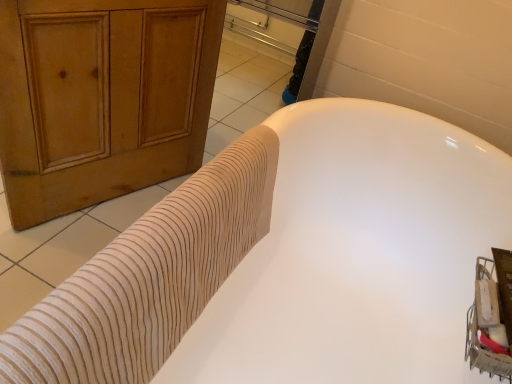
This screenshot has width=512, height=384. Describe the element at coordinates (358, 254) in the screenshot. I see `white ribbed tub at center` at that location.

In order to click on white ribbed tub at center in this screenshot , I will do `click(358, 254)`.

The image size is (512, 384). What do you see at coordinates (149, 277) in the screenshot?
I see `beige textured towel at upper left` at bounding box center [149, 277].

The width and height of the screenshot is (512, 384). In order to click on beige textured towel at upper left in this screenshot , I will do `click(149, 277)`.

Locate an element on the screen. This screenshot has width=512, height=384. white ribbed tub at center is located at coordinates pos(358,254).

Does white ribbed tub at center appear on the right side of beige textured towel at upper left?

Indeed, white ribbed tub at center is positioned on the right side of beige textured towel at upper left.

Considering the relative positions of white ribbed tub at center and beige textured towel at upper left in the image provided, is white ribbed tub at center behind beige textured towel at upper left?

No, the depth of white ribbed tub at center is less than that of beige textured towel at upper left.

Is point (464, 284) closer to camera compared to point (201, 302)?

That is False.

From the image's perspective, is white ribbed tub at center above or below beige textured towel at upper left?

white ribbed tub at center is below beige textured towel at upper left.

From a real-world perspective, is white ribbed tub at center on beige textured towel at upper left?

No, from a real-world perspective, white ribbed tub at center is not over beige textured towel at upper left

Is white ribbed tub at center wider or thinner than beige textured towel at upper left?

Clearly, white ribbed tub at center has more width compared to beige textured towel at upper left.

In terms of height, does white ribbed tub at center look taller or shorter compared to beige textured towel at upper left?

Considering their sizes, white ribbed tub at center has more height than beige textured towel at upper left.

Can you confirm if white ribbed tub at center is bigger than beige textured towel at upper left?

Yes, white ribbed tub at center is bigger than beige textured towel at upper left.

Does white ribbed tub at center contain beige textured towel at upper left?

That's correct, beige textured towel at upper left is inside white ribbed tub at center.

Is white ribbed tub at center directly adjacent to beige textured towel at upper left?

No.

Based on the photo, is white ribbed tub at center facing away from beige textured towel at upper left?

No, beige textured towel at upper left is not at the back of white ribbed tub at center.

Can you tell me how much white ribbed tub at center and beige textured towel at upper left differ in facing direction?

1.79 degrees.

Measure the distance between white ribbed tub at center and beige textured towel at upper left.

white ribbed tub at center and beige textured towel at upper left are 10.88 inches apart from each other.

At what (x,y) coordinates should I click in order to perform the action: click on bath towel above the white ribbed tub at center (from a real-world perspective). Please return your answer as a coordinate pair (x, y). Looking at the image, I should click on (149, 277).

Does beige textured towel at upper left appear on the left side of white ribbed tub at center?

Correct, you'll find beige textured towel at upper left to the left of white ribbed tub at center.

Based on the photo, which is behind, beige textured towel at upper left or white ribbed tub at center?

beige textured towel at upper left is further from the camera.

Which is in front, point (18, 324) or point (507, 165)?

Positioned in front is point (18, 324).

From the image's perspective, is beige textured towel at upper left located above or below white ribbed tub at center?

Based on their image positions, beige textured towel at upper left is located above white ribbed tub at center.

From a real-world perspective, is beige textured towel at upper left physically below white ribbed tub at center?

No, from a real-world perspective, beige textured towel at upper left is not beneath white ribbed tub at center.

Which object is wider, beige textured towel at upper left or white ribbed tub at center?

white ribbed tub at center.

Considering the relative sizes of beige textured towel at upper left and white ribbed tub at center in the image provided, is beige textured towel at upper left shorter than white ribbed tub at center?

Yes.

Between beige textured towel at upper left and white ribbed tub at center, which one has smaller size?

beige textured towel at upper left.

Would you say beige textured towel at upper left is inside or outside white ribbed tub at center?

beige textured towel at upper left is contained in white ribbed tub at center.

Is beige textured towel at upper left positioned far away from white ribbed tub at center?

No, beige textured towel at upper left is in close proximity to white ribbed tub at center.

Could you tell me if beige textured towel at upper left is facing white ribbed tub at center?

Yes, beige textured towel at upper left faces towards white ribbed tub at center.

Can you tell me how much beige textured towel at upper left and white ribbed tub at center differ in facing direction?

1.79 degrees separate the facing orientations of beige textured towel at upper left and white ribbed tub at center.

How much distance is there between beige textured towel at upper left and white ribbed tub at center?

beige textured towel at upper left is 10.88 inches away from white ribbed tub at center.

Find the location of a particular element. bath towel that appears above the white ribbed tub at center (from a real-world perspective) is located at coordinates (149, 277).

The width and height of the screenshot is (512, 384). Identify the location of bath towel on the left of the white ribbed tub at center. (149, 277).

The width and height of the screenshot is (512, 384). Find the location of `bathtub in front of the beige textured towel at upper left`. bathtub in front of the beige textured towel at upper left is located at coordinates (358, 254).